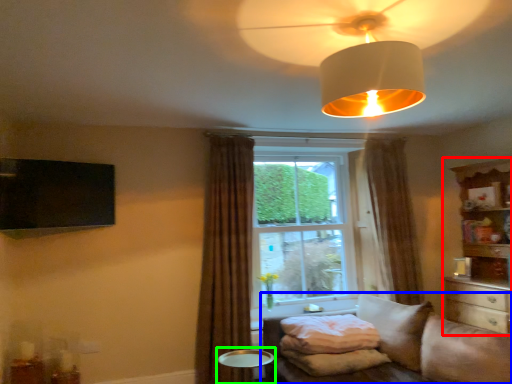
Question: Which object is positioned closest to entertainment center (highlighted by a red box)? Select from studio couch (highlighted by a blue box) and round table (highlighted by a green box).

Choices:
 (A) studio couch
 (B) round table

Answer: (A)